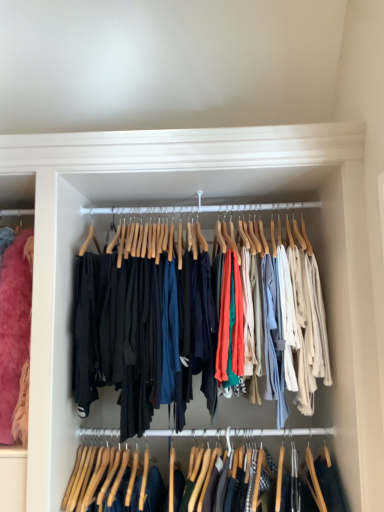
Describe the element at coordinates (154, 326) in the screenshot. I see `matte black pants at center, which appears as the first closet when viewed from the top` at that location.

Find the location of `matte black pants at center, the 2th closet from the bottom`. matte black pants at center, the 2th closet from the bottom is located at coordinates (154, 326).

Image resolution: width=384 pixels, height=512 pixels. Describe the element at coordinates (256, 469) in the screenshot. I see `denim jeans at center, the 2th closet from the top` at that location.

Image resolution: width=384 pixels, height=512 pixels. Identify the location of denim jeans at center, acting as the 1th closet starting from the bottom. (256, 469).

Where is `matte black pants at center, which appears as the first closet when viewed from the top`? This screenshot has width=384, height=512. matte black pants at center, which appears as the first closet when viewed from the top is located at coordinates (154, 326).

Based on the photo, does denim jeans at center, acting as the 1th closet starting from the bottom, appear on the left side of matte black pants at center, the 2th closet from the bottom?

No, denim jeans at center, acting as the 1th closet starting from the bottom, is not to the left of matte black pants at center, the 2th closet from the bottom.

Is denim jeans at center, acting as the 1th closet starting from the bottom, in front of or behind matte black pants at center, which appears as the first closet when viewed from the top, in the image?

Clearly, denim jeans at center, acting as the 1th closet starting from the bottom, is in front of matte black pants at center, which appears as the first closet when viewed from the top.

Is point (217, 470) farther from viewer compared to point (165, 336)?

Yes, it is.

Looking at this image, from the image's perspective, would you say denim jeans at center, acting as the 1th closet starting from the bottom, is positioned over matte black pants at center, the 2th closet from the bottom?

Actually, denim jeans at center, acting as the 1th closet starting from the bottom, appears below matte black pants at center, the 2th closet from the bottom, in the image.

From a real-world perspective, is denim jeans at center, acting as the 1th closet starting from the bottom, beneath matte black pants at center, which appears as the first closet when viewed from the top?

Yes.

Which object is wider, denim jeans at center, acting as the 1th closet starting from the bottom, or matte black pants at center, the 2th closet from the bottom?

Wider between the two is matte black pants at center, the 2th closet from the bottom.

Which of these two, denim jeans at center, acting as the 1th closet starting from the bottom, or matte black pants at center, the 2th closet from the bottom, stands shorter?

Standing shorter between the two is denim jeans at center, acting as the 1th closet starting from the bottom.

In the scene shown: Considering the sizes of objects denim jeans at center, the 2th closet from the top, and matte black pants at center, which appears as the first closet when viewed from the top, in the image provided, who is bigger, denim jeans at center, the 2th closet from the top, or matte black pants at center, which appears as the first closet when viewed from the top,?

matte black pants at center, which appears as the first closet when viewed from the top.

Could matte black pants at center, which appears as the first closet when viewed from the top, be considered to be inside denim jeans at center, the 2th closet from the top?

Definitely not — matte black pants at center, which appears as the first closet when viewed from the top, is not inside denim jeans at center, the 2th closet from the top.

Consider the image. Are denim jeans at center, the 2th closet from the top, and matte black pants at center, the 2th closet from the bottom, far apart?

No, denim jeans at center, the 2th closet from the top, is in close proximity to matte black pants at center, the 2th closet from the bottom.

Is denim jeans at center, acting as the 1th closet starting from the bottom, positioned with its back to matte black pants at center, the 2th closet from the bottom?

No, matte black pants at center, the 2th closet from the bottom, is not at the back of denim jeans at center, acting as the 1th closet starting from the bottom.

The image size is (384, 512). There is a denim jeans at center, the 2th closet from the top. Find the location of `closet above it (from a real-world perspective)`. closet above it (from a real-world perspective) is located at coordinates (154, 326).

Can you confirm if matte black pants at center, which appears as the first closet when viewed from the top, is positioned to the right of denim jeans at center, acting as the 1th closet starting from the bottom?

No.

Is matte black pants at center, which appears as the first closet when viewed from the top, further to the viewer compared to denim jeans at center, acting as the 1th closet starting from the bottom?

Yes, it is behind denim jeans at center, acting as the 1th closet starting from the bottom.

Which is more distant, [219,277] or [138,479]?

Positioned behind is point [138,479].

From the image's perspective, relative to denim jeans at center, acting as the 1th closet starting from the bottom, is matte black pants at center, the 2th closet from the bottom, above or below?

From the image's perspective, matte black pants at center, the 2th closet from the bottom, appears above denim jeans at center, acting as the 1th closet starting from the bottom.

From a real-world perspective, who is located higher, matte black pants at center, the 2th closet from the bottom, or denim jeans at center, acting as the 1th closet starting from the bottom?

matte black pants at center, the 2th closet from the bottom, is physically above.

Is matte black pants at center, the 2th closet from the bottom, thinner than denim jeans at center, the 2th closet from the top?

In fact, matte black pants at center, the 2th closet from the bottom, might be wider than denim jeans at center, the 2th closet from the top.

Considering the sizes of objects matte black pants at center, which appears as the first closet when viewed from the top, and denim jeans at center, the 2th closet from the top, in the image provided, who is taller, matte black pants at center, which appears as the first closet when viewed from the top, or denim jeans at center, the 2th closet from the top,?

With more height is matte black pants at center, which appears as the first closet when viewed from the top.

Which of these two, matte black pants at center, which appears as the first closet when viewed from the top, or denim jeans at center, the 2th closet from the top, is bigger?

Bigger between the two is matte black pants at center, which appears as the first closet when viewed from the top.

Is matte black pants at center, which appears as the first closet when viewed from the top, completely or partially outside of denim jeans at center, the 2th closet from the top?

matte black pants at center, which appears as the first closet when viewed from the top, is positioned outside denim jeans at center, the 2th closet from the top.

Consider the image. Are matte black pants at center, the 2th closet from the bottom, and denim jeans at center, acting as the 1th closet starting from the bottom, making contact?

There is a gap between matte black pants at center, the 2th closet from the bottom, and denim jeans at center, acting as the 1th closet starting from the bottom.

Could you tell me if matte black pants at center, the 2th closet from the bottom, is turned towards denim jeans at center, acting as the 1th closet starting from the bottom?

No, matte black pants at center, the 2th closet from the bottom, is not turned towards denim jeans at center, acting as the 1th closet starting from the bottom.

This screenshot has width=384, height=512. I want to click on closet in front of the matte black pants at center, the 2th closet from the bottom, so 256,469.

Identify the location of closet located above the denim jeans at center, the 2th closet from the top (from the image's perspective). (154, 326).

Locate an element on the screen. The image size is (384, 512). closet that is above the denim jeans at center, acting as the 1th closet starting from the bottom (from a real-world perspective) is located at coordinates (154, 326).